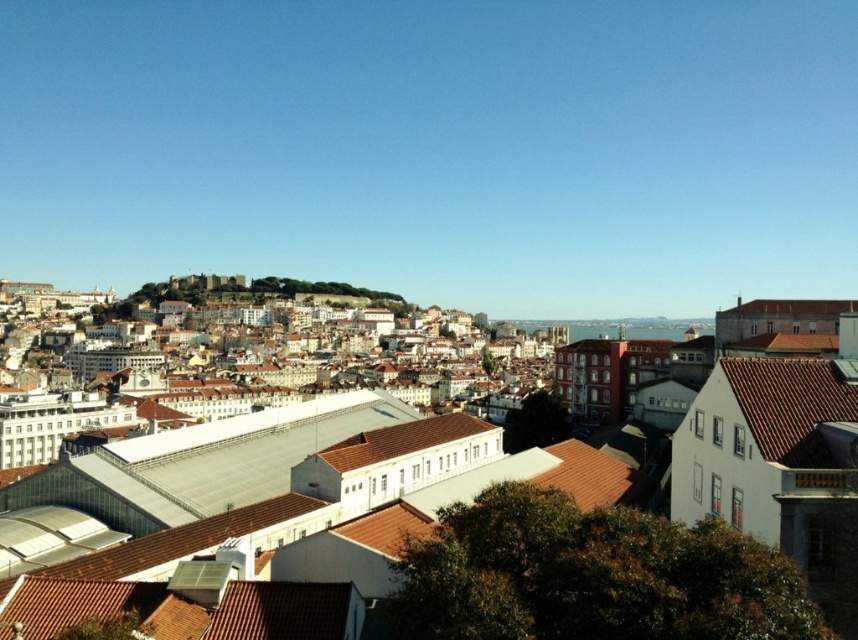
Question: Is brown tiled roofs at center wider than brown tile roof at right?

Choices:
 (A) yes
 (B) no

Answer: (A)

Question: Can you confirm if brown tiled roofs at center is thinner than brown tile roof at right?

Choices:
 (A) no
 (B) yes

Answer: (A)

Question: Which object is farther from the camera taking this photo?

Choices:
 (A) brown tiled roofs at center
 (B) brown tile roof at right

Answer: (B)

Question: Which point is closer to the camera?

Choices:
 (A) brown tiled roofs at center
 (B) brown tile roof at right

Answer: (A)

Question: Is the position of brown tiled roofs at center more distant than that of brown tile roof at right?

Choices:
 (A) yes
 (B) no

Answer: (B)